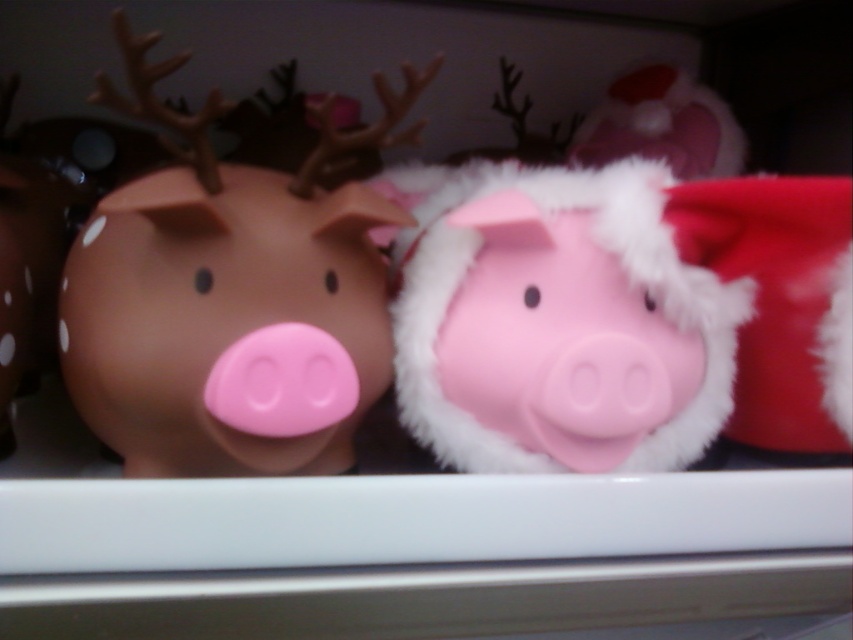
Does point (360, 397) come behind point (485, 337)?

No, it is not.

Where is `brown matte piggy bank at left`? This screenshot has height=640, width=853. brown matte piggy bank at left is located at coordinates (230, 296).

Where is `brown matte piggy bank at left`? brown matte piggy bank at left is located at coordinates (230, 296).